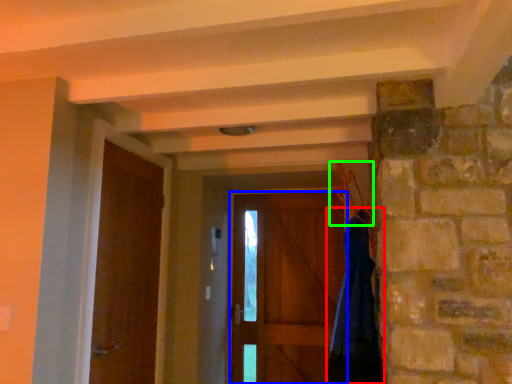
Question: Estimate the real-world distances between objects in this image. Which object is closer to dress (highlighted by a red box), door (highlighted by a blue box) or hanger (highlighted by a green box)?

Choices:
 (A) door
 (B) hanger

Answer: (B)